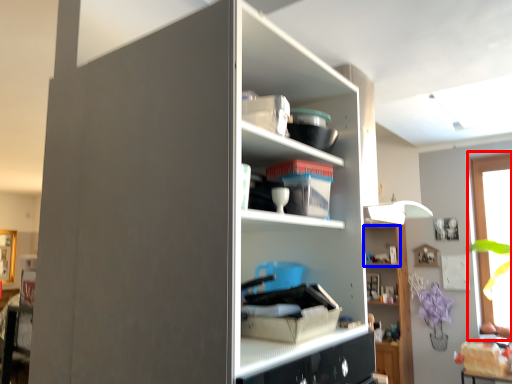
Question: Which object is closer to the camera taking this photo, window (highlighted by a red box) or cabinet (highlighted by a blue box)?

Choices:
 (A) window
 (B) cabinet

Answer: (A)